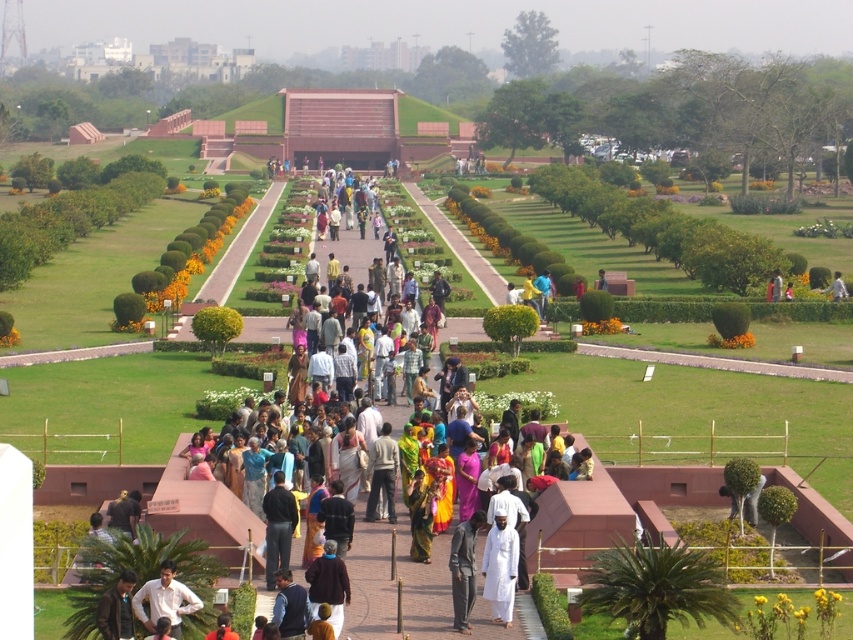
You are a photographer at the event and want to capture both the white matte shirt at center and the dark brown leather jacket at lower left in a single frame. Based on their sizes, which clothing item will appear larger in the photo?

The white matte shirt at center will appear larger in the photo because its width is larger than the dark brown leather jacket at lower left.

From the picture: You are standing at the entrance of the historical site and want to take a photo of the dark gray fabric pants at center. Where should you position yourself to capture the pants in the frame?

To capture the dark gray fabric pants at center in the frame, position yourself at the entrance and aim your camera towards the coordinates point (463, 570) where the pants are located.